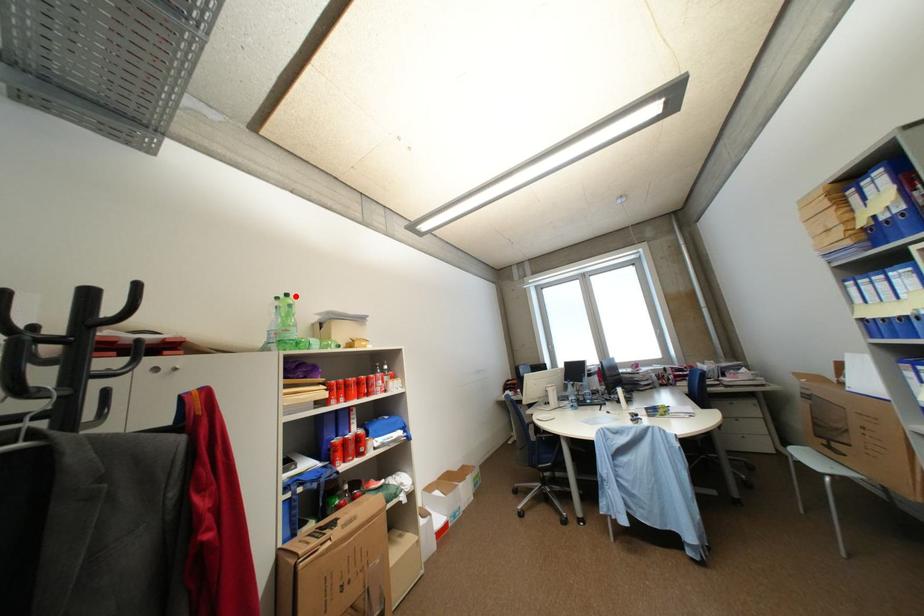
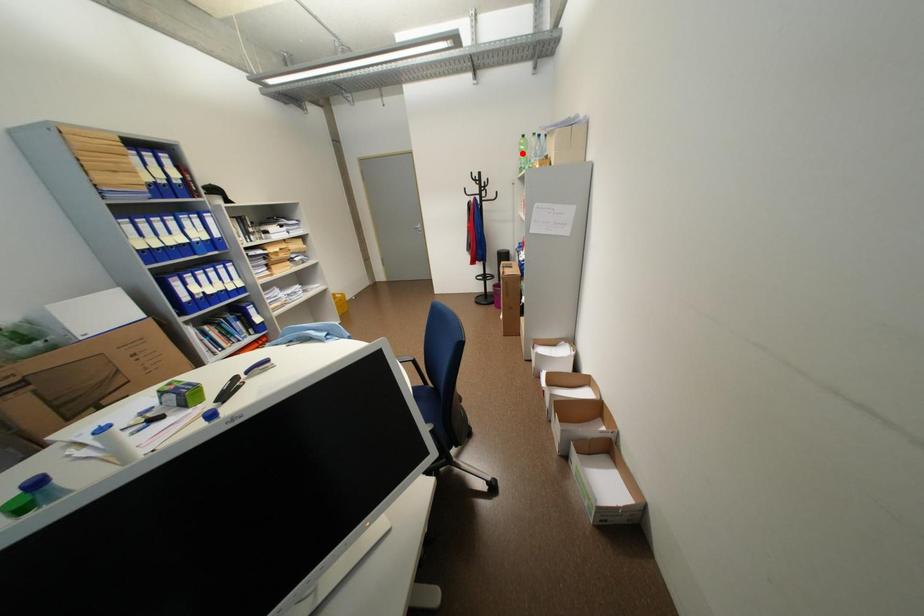
I am providing you with two images of the same scene from different viewpoints. A red point is marked on the first image and another point is marked on the second image. Does the point marked in image1 correspond to the same location as the one in image2?

No